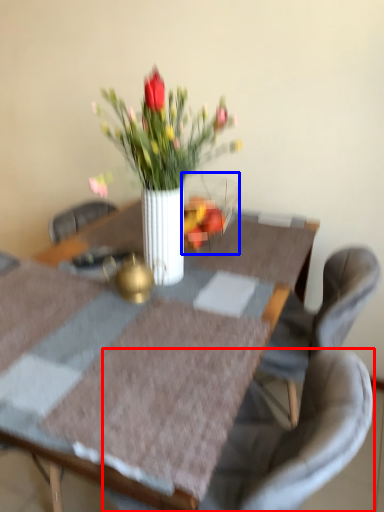
Question: Which object is further to the camera taking this photo, chair (highlighted by a red box) or glass vase (highlighted by a blue box)?

Choices:
 (A) chair
 (B) glass vase

Answer: (B)